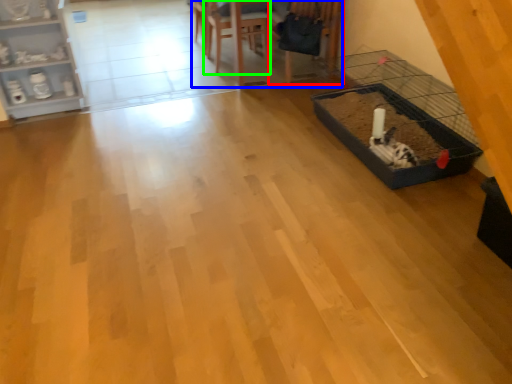
Question: Which object is the closest to the armchair (highlighted by a red box)? Choose among these: table (highlighted by a blue box) or armchair (highlighted by a green box).

Choices:
 (A) table
 (B) armchair

Answer: (A)